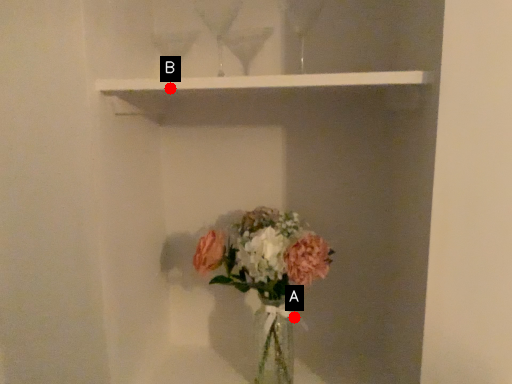
Question: Two points are circled on the image, labeled by A and B beside each circle. Among these points, which one is farthest from the camera?

Choices:
 (A) A is further
 (B) B is further

Answer: (A)